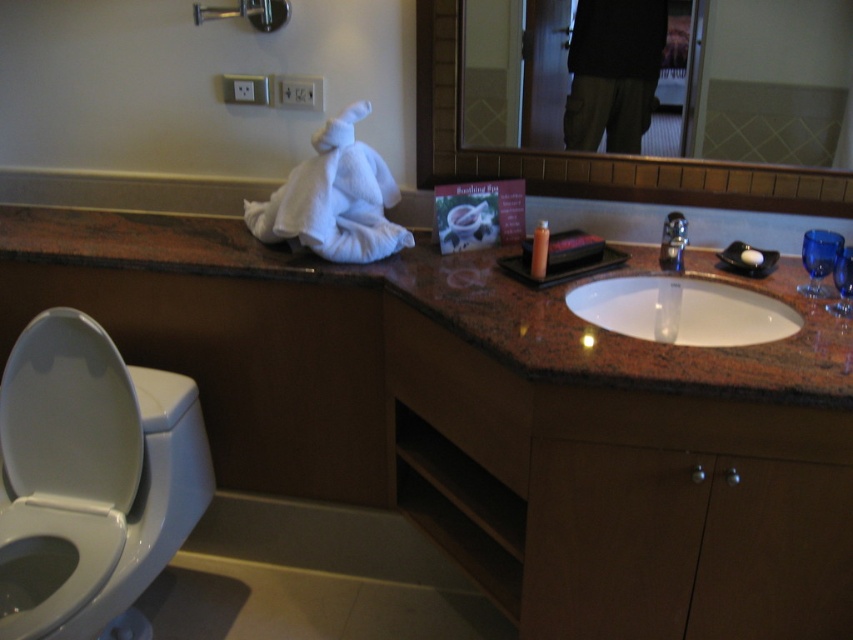
You are a guest in this bathroom and need to locate the soap dispenser. You see the white glossy toilet bowl at lower left and the matte plastic soap dispenser at center. Which object is positioned higher up in the image?

The matte plastic soap dispenser at center is positioned higher up than the white glossy toilet bowl at lower left.

Based on the photo, you are designing a bathroom layout and need to place a decorative vase that requires a stable, flat surface. Which object between the brown granite countertop at center and the dark fabric pants at upper center would be the better choice for placing the vase?

The brown granite countertop at center has a greater height compared to the dark fabric pants at upper center, making it the more stable and flat surface for placing the decorative vase.

You are designing a bathroom layout and need to place a new plant that requires a large surface area. Based on the image, which object, the brown polished granite vanity at center or the white glossy toilet bowl at lower left, would be more suitable to place the plant on?

The brown polished granite vanity at center is bigger than the white glossy toilet bowl at lower left, so it would be more suitable to place the plant on the brown polished granite vanity at center since it provides a larger surface area.